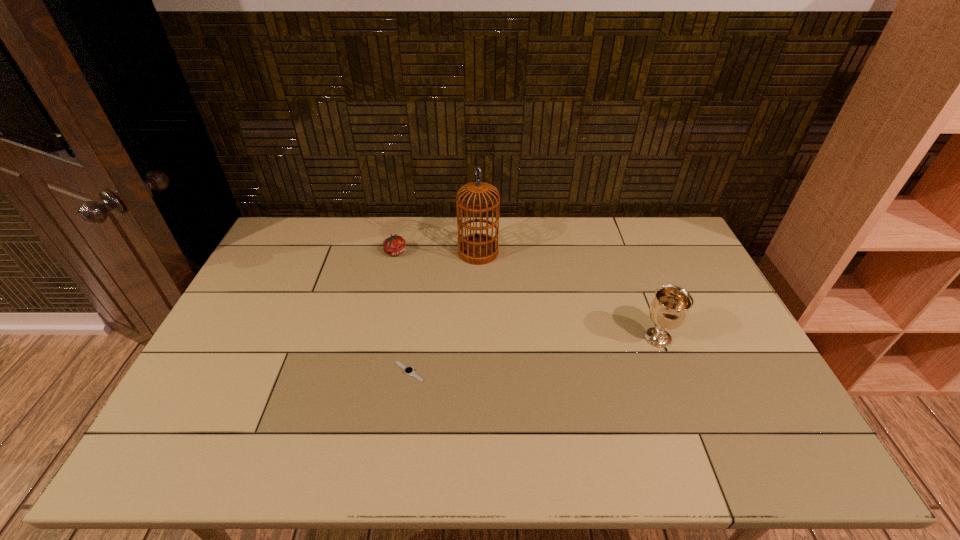
Identify the location of free space between the tallest object and the third farthest object. (568, 295).

Where is `vacant space that is in between the third tallest object and the rightmost object`? The image size is (960, 540). vacant space that is in between the third tallest object and the rightmost object is located at coordinates (527, 295).

Choose which object is the nearest neighbor to the watch. Please provide its 2D coordinates. Your answer should be formatted as a tuple, i.e. [(x, y)], where the tuple contains the x and y coordinates of a point satisfying the conditions above.

[(477, 249)]

This screenshot has width=960, height=540. What are the coordinates of `object that is the third closest to the chalice` in the screenshot? It's located at (395, 245).

Image resolution: width=960 pixels, height=540 pixels. I want to click on blank area in the image that satisfies the following two spatial constraints: 1. on the front side of the chalice; 2. on the right side of the second shortest object, so click(x=376, y=338).

You are a GUI agent. You are given a task and a screenshot of the screen. Output one action in this format:
    pyautogui.click(x=<x>, y=<y>)
    Task: Click on the vacant position in the image that satisfies the following two spatial constraints: 1. on the front side of the tallest object; 2. on the right side of the second nearest object
    The image size is (960, 540).
    Given the screenshot: What is the action you would take?
    pyautogui.click(x=478, y=338)